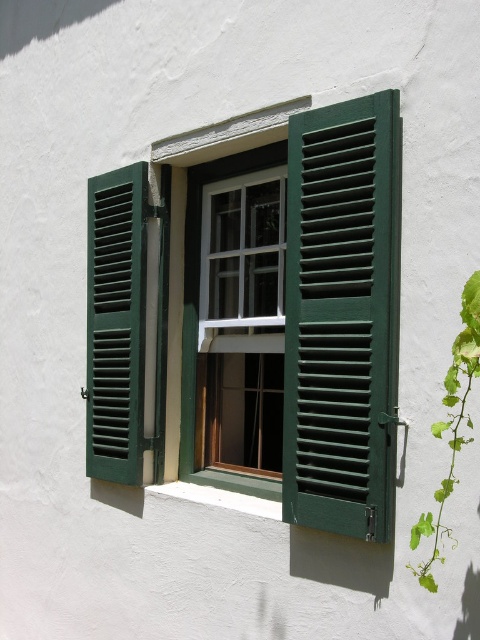
You are standing in front of the building and want to know if the point at coordinate (x=120, y=340) is closer to you than the point at coordinate (x=448, y=426). Can you determine this based on their positions?

Point (x=120, y=340) is behind point (x=448, y=426), so it is farther away from you.

You are an architect designing a new building and want to ensure the green painted wood shutter at center and the green leafy vine at right are proportionate. Based on the image, which object is wider?

The green painted wood shutter at center is wider than the green leafy vine at right.